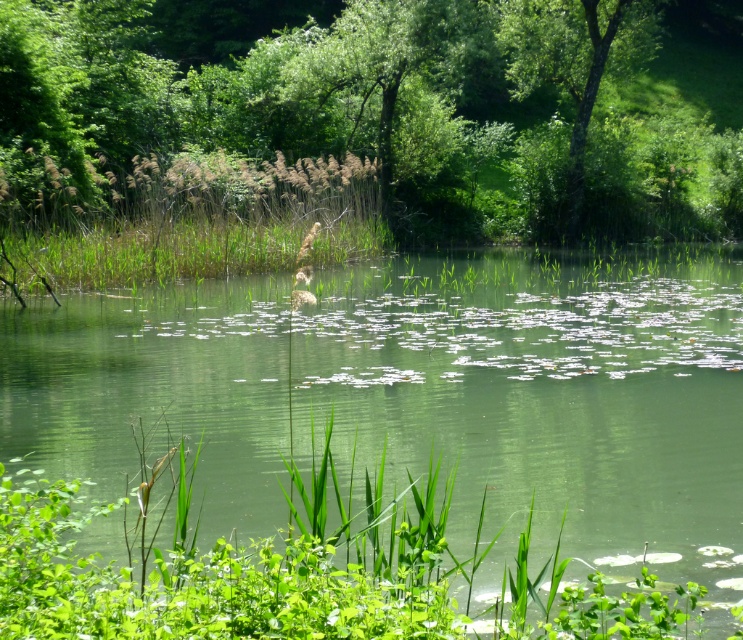
Is green leafy vegetation at center smaller than green leafy tree at upper center?

Indeed, green leafy vegetation at center has a smaller size compared to green leafy tree at upper center.

Which is in front, point (137, 308) or point (681, 132)?

Point (137, 308) is more forward.

Describe the element at coordinates (421, 397) in the screenshot. I see `green leafy vegetation at center` at that location.

At what (x,y) coordinates should I click in order to perform the action: click on green leafy vegetation at center. Please return your answer as a coordinate pair (x, y). Looking at the image, I should click on (421, 397).

Is green leafy vegetation at center shorter than green leafy tree at upper right?

Yes.

Is the position of green leafy vegetation at center less distant than that of green leafy tree at upper right?

Yes, green leafy vegetation at center is in front of green leafy tree at upper right.

Where is `green leafy vegetation at center`? The image size is (743, 640). green leafy vegetation at center is located at coordinates (421, 397).

Can you confirm if green leafy vegetation at center is bigger than green leafy grass at center?

Indeed, green leafy vegetation at center has a larger size compared to green leafy grass at center.

Is green leafy vegetation at center smaller than green leafy grass at center?

No, green leafy vegetation at center is not smaller than green leafy grass at center.

The width and height of the screenshot is (743, 640). What do you see at coordinates (421, 397) in the screenshot?
I see `green leafy vegetation at center` at bounding box center [421, 397].

Locate an element on the screen. Image resolution: width=743 pixels, height=640 pixels. green leafy vegetation at center is located at coordinates (421, 397).